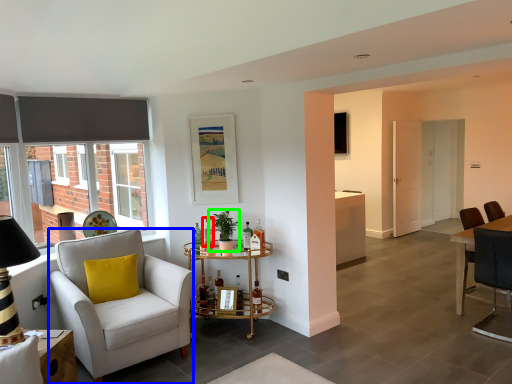
Question: Considering the real-world distances, which object is farthest from bottle (highlighted by a red box)? chair (highlighted by a blue box) or houseplant (highlighted by a green box)?

Choices:
 (A) chair
 (B) houseplant

Answer: (A)